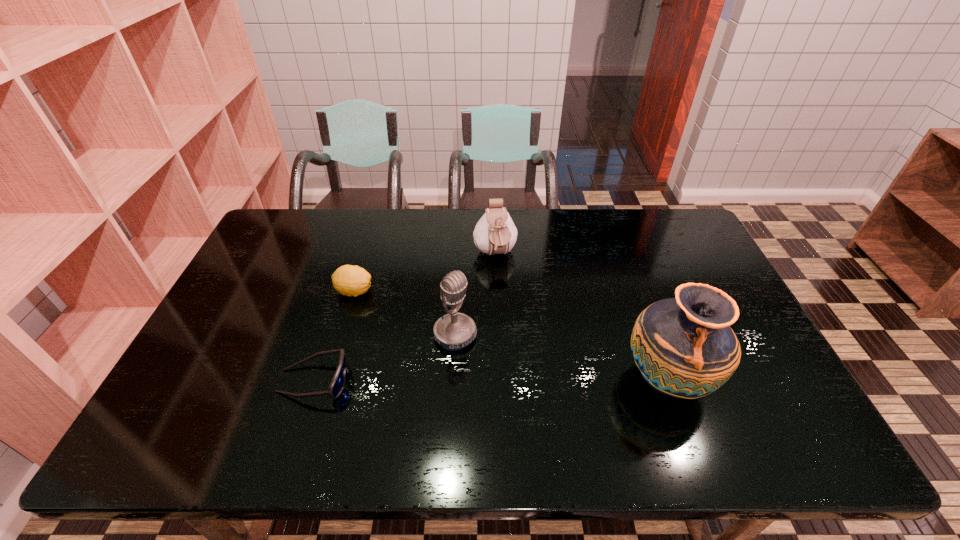
Find the location of a particular element. The width and height of the screenshot is (960, 540). free space on the desktop that is between the shortest object and the tallest object and is positioned on the front-facing side of the farthest object is located at coordinates (530, 380).

This screenshot has width=960, height=540. I want to click on free space on the desktop that is between the shortest object and the rightmost object and is positioned at the stem end of the lemon, so click(512, 380).

This screenshot has height=540, width=960. Identify the location of free spot on the desktop that is between the sunglasses and the pottery and is positioned on the front-facing side of the microphone. (508, 380).